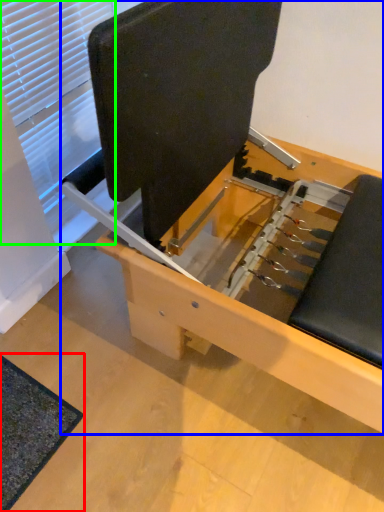
Question: Estimate the real-world distances between objects in this image. Which object is closer to mat (highlighted by a red box), furniture (highlighted by a blue box) or window (highlighted by a green box)?

Choices:
 (A) furniture
 (B) window

Answer: (A)